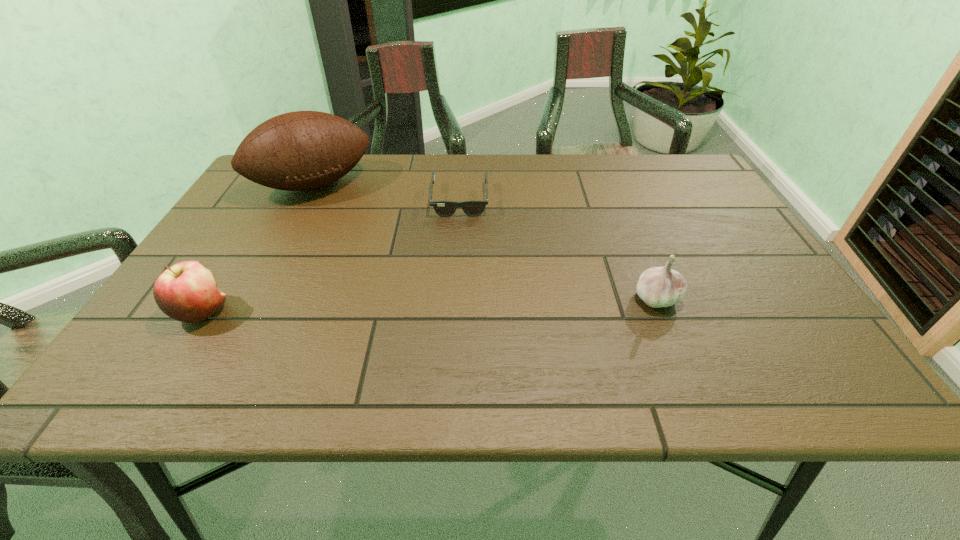
Locate an element on the screen. This screenshot has height=540, width=960. vacant space on the desktop that is between the apple and the garlic and is positioned on the temples of the second object from right to left is located at coordinates (456, 304).

Image resolution: width=960 pixels, height=540 pixels. Identify the location of free spot on the desktop that is between the apple and the garlic and is positioned on the laces of the tallest object. (380, 306).